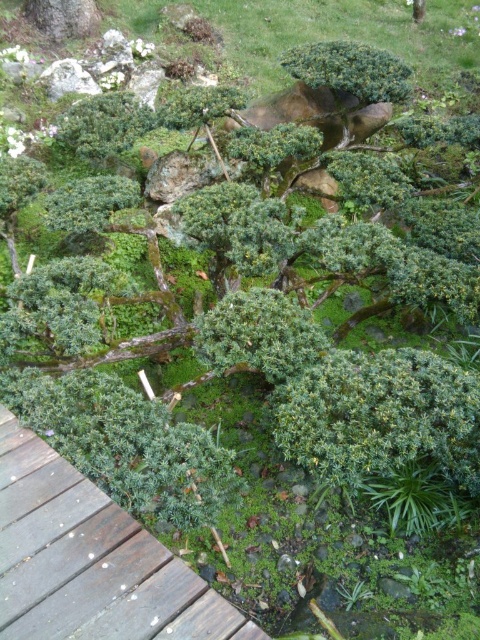
Question: Which object appears closest to the camera in this image?

Choices:
 (A) green matte bush at upper center
 (B) green leafy bush at center
 (C) brown wooden path at lower left

Answer: (C)

Question: Can you confirm if brown wooden path at lower left is smaller than green leafy bush at center?

Choices:
 (A) yes
 (B) no

Answer: (B)

Question: Which object is closer to the camera taking this photo?

Choices:
 (A) green matte bush at upper center
 (B) brown wooden path at lower left
 (C) green leafy bush at center

Answer: (B)

Question: Which point is closer to the camera?

Choices:
 (A) green leafy bush at center
 (B) brown wooden path at lower left

Answer: (B)

Question: Does green leafy bush at center appear under green matte bush at upper center?

Choices:
 (A) yes
 (B) no

Answer: (A)

Question: Is green leafy bush at center below green matte bush at upper center?

Choices:
 (A) no
 (B) yes

Answer: (B)